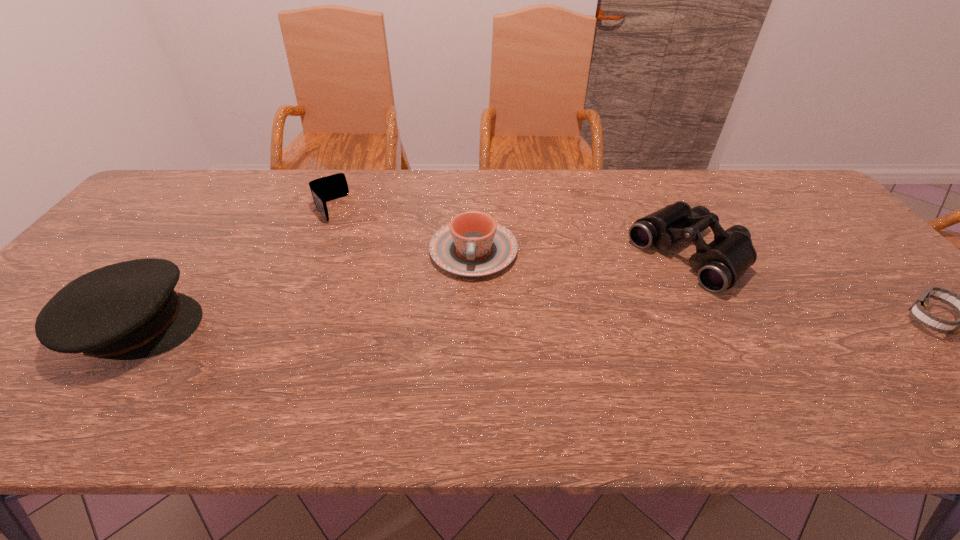
Identify the location of the leftmost object. The width and height of the screenshot is (960, 540). coord(129,310).

Locate an element on the screen. This screenshot has height=540, width=960. the fourth object from right to left is located at coordinates (328, 188).

Where is `the fourth object from left to right`? the fourth object from left to right is located at coordinates (719, 264).

At what (x,y) coordinates should I click in order to perform the action: click on the third object from right to left. Please return your answer as a coordinate pair (x, y). Image resolution: width=960 pixels, height=540 pixels. Looking at the image, I should click on (472, 245).

At what (x,y) coordinates should I click in order to perform the action: click on vacant area situated 0.310m on the front-facing side of the beret. Please return your answer as a coordinate pair (x, y). Looking at the image, I should click on (332, 326).

Identify the location of vacant space located 0.240m on the outer surface of the fourth object from right to left. The image size is (960, 540). (367, 266).

Where is `free point located 0.050m on the outer surface of the fourth object from right to left`? free point located 0.050m on the outer surface of the fourth object from right to left is located at coordinates (340, 230).

You are a GUI agent. You are given a task and a screenshot of the screen. Output one action in this format:
    pyautogui.click(x=<x>, y=<y>)
    Task: Click on the free space located on the outer surface of the fourth object from right to left
    The width and height of the screenshot is (960, 540).
    Given the screenshot: What is the action you would take?
    pyautogui.click(x=379, y=284)

Find the location of `free spot located on the front-facing side of the second object from right to left`. free spot located on the front-facing side of the second object from right to left is located at coordinates (566, 345).

What are the coordinates of `free space located on the front-facing side of the second object from right to left` in the screenshot? It's located at (639, 293).